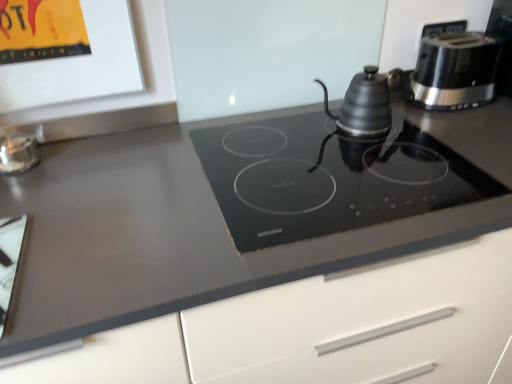
Find the location of a particular element. This screenshot has width=512, height=384. vacant area that lies in front of black plastic toaster at upper right, arranged as the second kitchen appliance when viewed from the left is located at coordinates (471, 125).